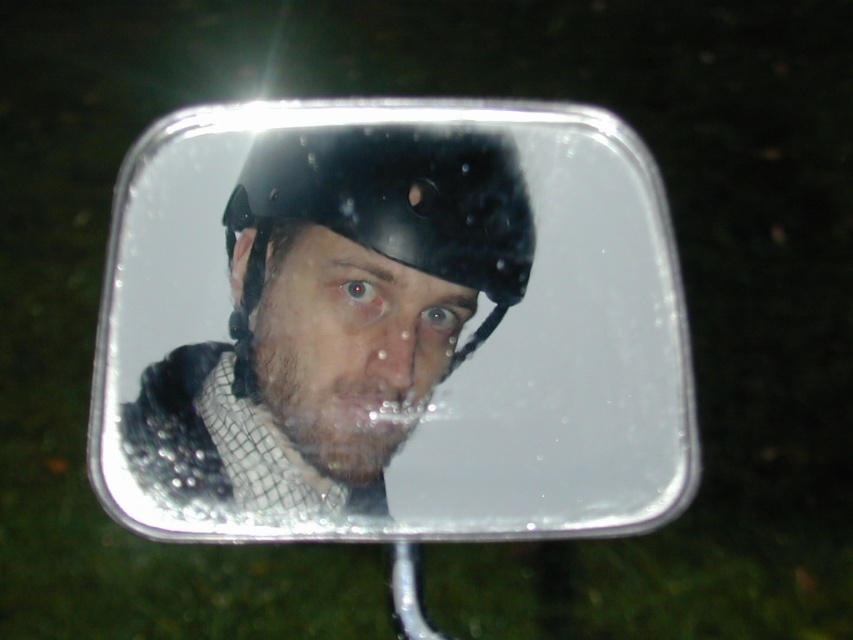
Question: Which point appears closest to the camera in this image?

Choices:
 (A) (192, 380)
 (B) (303, 288)

Answer: (A)

Question: Is matte black helmet at center to the left of shiny black helmet at center from the viewer's perspective?

Choices:
 (A) no
 (B) yes

Answer: (B)

Question: Is matte black helmet at center wider than shiny black helmet at center?

Choices:
 (A) no
 (B) yes

Answer: (B)

Question: Does matte black helmet at center appear on the left side of shiny black helmet at center?

Choices:
 (A) yes
 (B) no

Answer: (A)